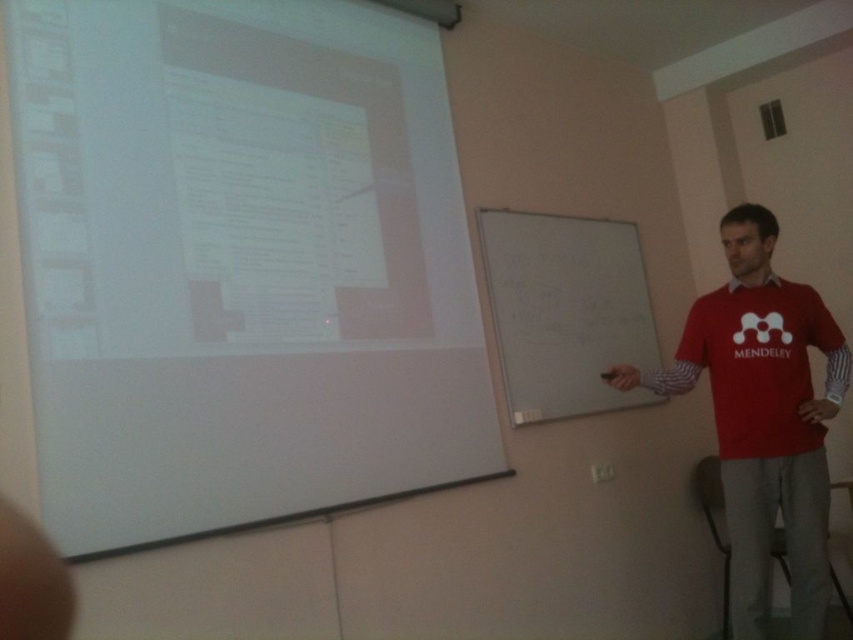
Is white matte projection screen at upper left thinner than red cotton shirt at right?

In fact, white matte projection screen at upper left might be wider than red cotton shirt at right.

Which is more to the right, white matte projection screen at upper left or red cotton shirt at right?

red cotton shirt at right

Is point (225, 476) behind point (759, 292)?

No, (225, 476) is in front of (759, 292).

Find the location of a particular element. The height and width of the screenshot is (640, 853). white matte projection screen at upper left is located at coordinates (239, 264).

Which is below, white matte projection screen at upper left or red matte shirt at right?

red matte shirt at right

Is white matte projection screen at upper left to the left of red matte shirt at right from the viewer's perspective?

Yes, white matte projection screen at upper left is to the left of red matte shirt at right.

Is point (90, 67) farther from viewer compared to point (809, 339)?

No, (90, 67) is closer to viewer.

The image size is (853, 640). Identify the location of white matte projection screen at upper left. (239, 264).

Which is more to the right, white matte projection screen at upper left or whiteboard at center?

whiteboard at center is more to the right.

Can you confirm if white matte projection screen at upper left is positioned to the right of whiteboard at center?

In fact, white matte projection screen at upper left is to the left of whiteboard at center.

Describe the element at coordinates (239, 264) in the screenshot. I see `white matte projection screen at upper left` at that location.

Image resolution: width=853 pixels, height=640 pixels. Find the location of `white matte projection screen at upper left`. white matte projection screen at upper left is located at coordinates (239, 264).